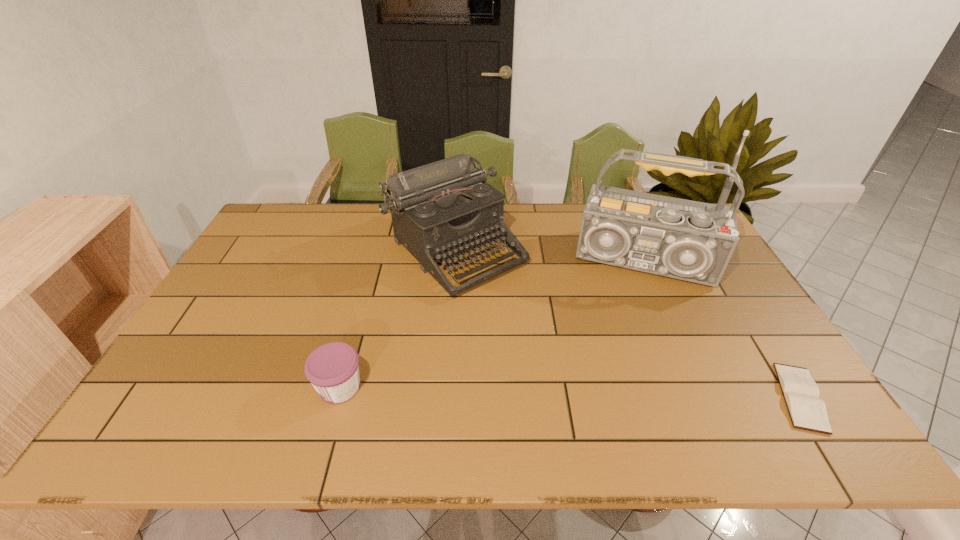
You are a GUI agent. You are given a task and a screenshot of the screen. Output one action in this format:
    pyautogui.click(x=<x>, y=<y>)
    Task: Click on the vacant point located between the second shortest object and the tallest object
    
    Given the screenshot: What is the action you would take?
    coord(493,325)

The width and height of the screenshot is (960, 540). I want to click on free spot between the shortest object and the tallest object, so click(x=724, y=330).

I want to click on blank region between the typewriter and the third tallest object, so click(x=397, y=318).

Locate an element on the screen. The image size is (960, 540). vacant space that's between the diary and the radio receiver is located at coordinates coord(724,330).

I want to click on empty space between the diary and the typewriter, so click(628, 323).

Select which object appears as the third closest to the diary. Please provide its 2D coordinates. Your answer should be formatted as a tuple, i.e. [(x, y)], where the tuple contains the x and y coordinates of a point satisfying the conditions above.

[(333, 369)]

Find the location of `the closest object to the shortest object`. the closest object to the shortest object is located at coordinates (694, 241).